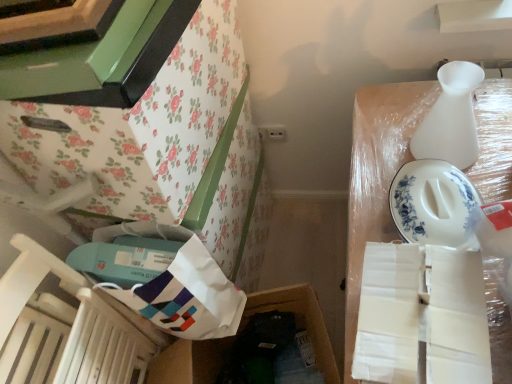
Find the location of a particular element. The width and height of the screenshot is (512, 384). blank space above white matte wrapping paper at right, which ranks as the second wrapping paper in back-to-front order (from a real-world perspective) is located at coordinates (422, 307).